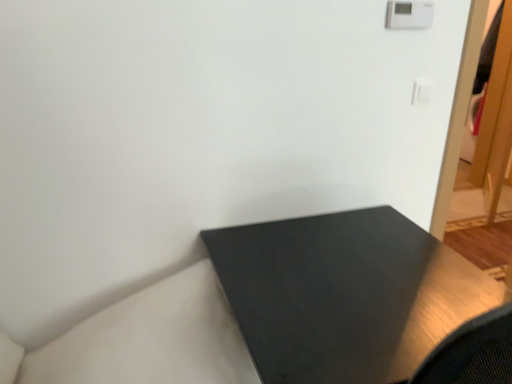
Image resolution: width=512 pixels, height=384 pixels. Find the location of `matte black table at lower left`. matte black table at lower left is located at coordinates (217, 238).

What do you see at coordinates (217, 238) in the screenshot? I see `matte black table at lower left` at bounding box center [217, 238].

This screenshot has width=512, height=384. What do you see at coordinates (422, 91) in the screenshot?
I see `white plastic light switch at upper right` at bounding box center [422, 91].

You are a GUI agent. You are given a task and a screenshot of the screen. Output one action in this format:
    pyautogui.click(x=<x>, y=<y>)
    Task: Click on the white plastic light switch at upper right
    The height and width of the screenshot is (384, 512).
    Given the screenshot: What is the action you would take?
    pyautogui.click(x=422, y=91)

Locate an element on the screen. matte black table at lower left is located at coordinates (217, 238).

Considering the relative positions of white plastic light switch at upper right and matte black table at lower left in the image provided, is white plastic light switch at upper right to the left or to the right of matte black table at lower left?

white plastic light switch at upper right is positioned on matte black table at lower left's right side.

Is white plastic light switch at upper right positioned before matte black table at lower left?

No, it is behind matte black table at lower left.

Which is behind, point (414, 85) or point (238, 228)?

The point (414, 85) is farther from the camera.

From the image's perspective, which one is positioned higher, white plastic light switch at upper right or matte black table at lower left?

white plastic light switch at upper right appears higher in the image.

From a real-world perspective, does white plastic light switch at upper right sit lower than matte black table at lower left?

No, from a real-world perspective, white plastic light switch at upper right is not below matte black table at lower left.

Is white plastic light switch at upper right wider or thinner than matte black table at lower left?

Clearly, white plastic light switch at upper right has less width compared to matte black table at lower left.

Considering the sizes of white plastic light switch at upper right and matte black table at lower left in the image, is white plastic light switch at upper right taller or shorter than matte black table at lower left?

Clearly, white plastic light switch at upper right is shorter compared to matte black table at lower left.

Considering the sizes of white plastic light switch at upper right and matte black table at lower left in the image, is white plastic light switch at upper right bigger or smaller than matte black table at lower left?

Clearly, white plastic light switch at upper right is smaller in size than matte black table at lower left.

Which is correct: white plastic light switch at upper right is inside matte black table at lower left, or outside of it?

white plastic light switch at upper right is not enclosed by matte black table at lower left.

Is white plastic light switch at upper right not close to matte black table at lower left?

No, there isn't a large distance between white plastic light switch at upper right and matte black table at lower left.

Is white plastic light switch at upper right looking in the opposite direction of matte black table at lower left?

white plastic light switch at upper right does not have its back to matte black table at lower left.

The width and height of the screenshot is (512, 384). I want to click on light switch on the right of matte black table at lower left, so click(x=422, y=91).

Between matte black table at lower left and white plastic light switch at upper right, which one appears on the left side from the viewer's perspective?

From the viewer's perspective, matte black table at lower left appears more on the left side.

Relative to white plastic light switch at upper right, is matte black table at lower left in front or behind?

Visually, matte black table at lower left is located in front of white plastic light switch at upper right.

Which is closer, (234, 295) or (416, 97)?

The point (234, 295) is in front.

From the image's perspective, is matte black table at lower left positioned above or below white plastic light switch at upper right?

Clearly, from the image's perspective, matte black table at lower left is below white plastic light switch at upper right.

Based on the photo, from a real-world perspective, between matte black table at lower left and white plastic light switch at upper right, who is vertically higher?

white plastic light switch at upper right is physically above.

Can you confirm if matte black table at lower left is thinner than white plastic light switch at upper right?

In fact, matte black table at lower left might be wider than white plastic light switch at upper right.

Which of these two, matte black table at lower left or white plastic light switch at upper right, stands taller?

Standing taller between the two is matte black table at lower left.

Looking at the image, does matte black table at lower left seem bigger or smaller compared to white plastic light switch at upper right?

Clearly, matte black table at lower left is larger in size than white plastic light switch at upper right.

Can we say matte black table at lower left lies outside white plastic light switch at upper right?

That's correct, matte black table at lower left is outside of white plastic light switch at upper right.

Is matte black table at lower left far from white plastic light switch at upper right?

No, matte black table at lower left is not far from white plastic light switch at upper right.

Could you tell me if matte black table at lower left is turned towards white plastic light switch at upper right?

No, matte black table at lower left is not facing towards white plastic light switch at upper right.

How far apart are matte black table at lower left and white plastic light switch at upper right?

The distance of matte black table at lower left from white plastic light switch at upper right is 24.55 inches.

You are a GUI agent. You are given a task and a screenshot of the screen. Output one action in this format:
    pyautogui.click(x=<x>, y=<y>)
    Task: Click on the light switch on the right of matte black table at lower left
    
    Given the screenshot: What is the action you would take?
    pyautogui.click(x=422, y=91)

The width and height of the screenshot is (512, 384). Find the location of `light switch that is above the matte black table at lower left (from the image's perspective)`. light switch that is above the matte black table at lower left (from the image's perspective) is located at coordinates (422, 91).

Locate an element on the screen. light switch that appears on the right of matte black table at lower left is located at coordinates (422, 91).